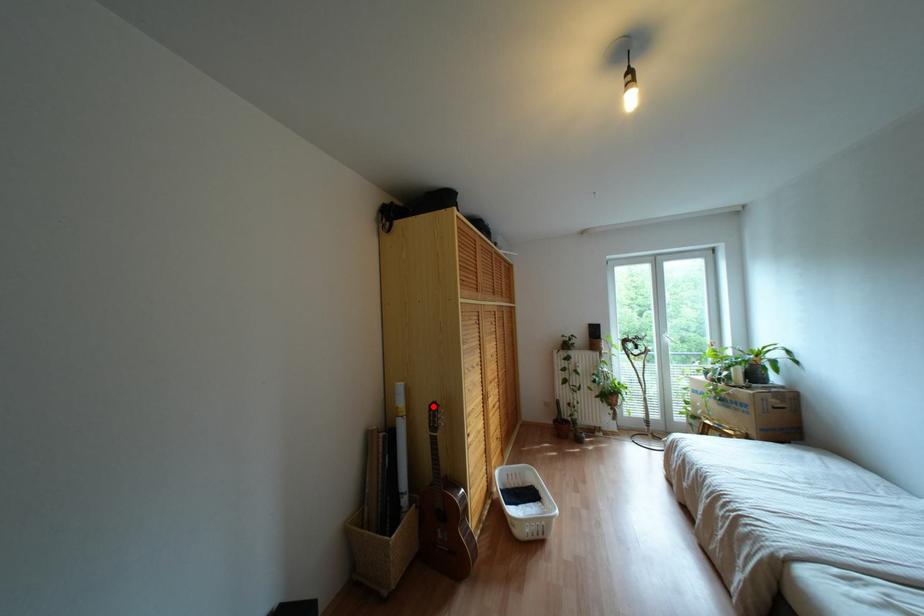
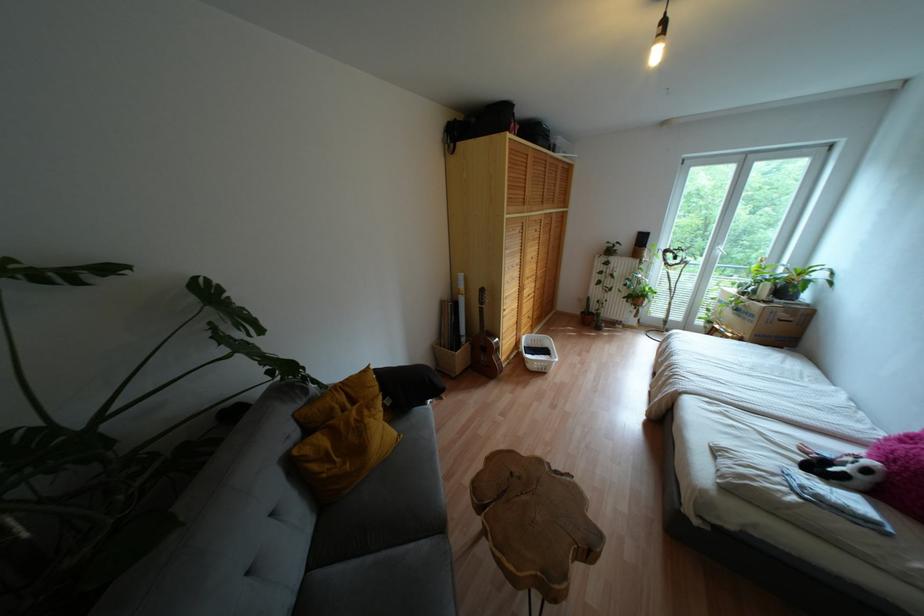
Find the pixel in the second image that matches the highlighted location in the first image.

(481, 290)